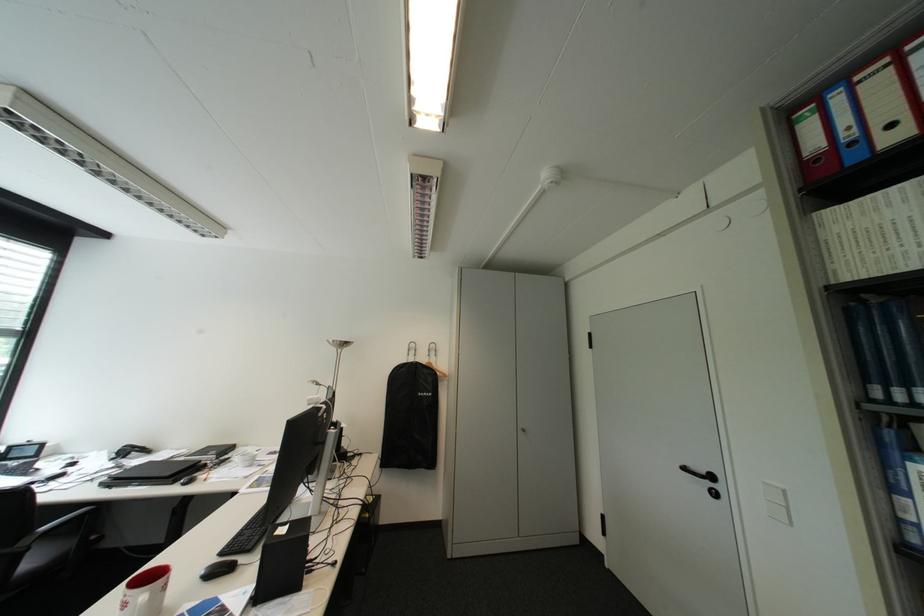
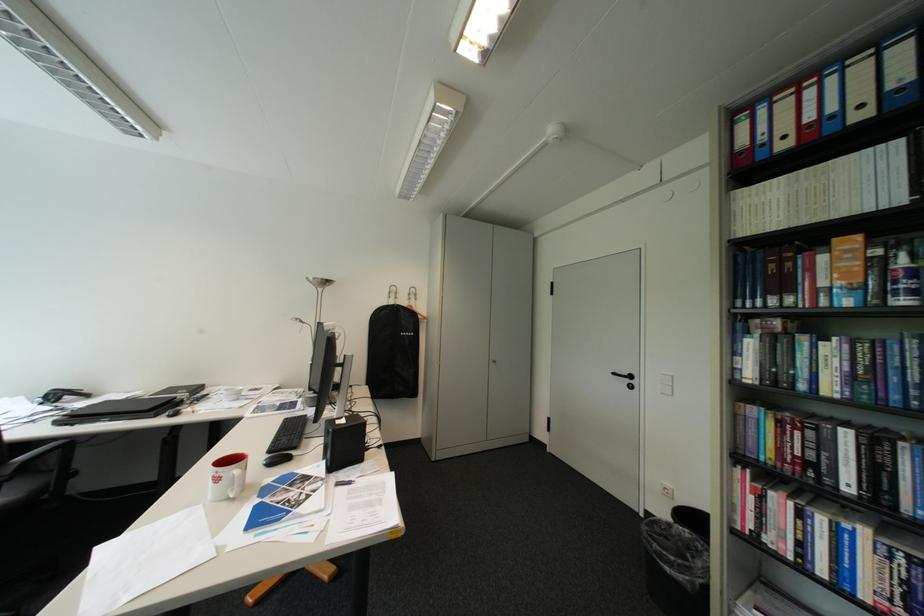
Where in the second image is the point corresponding to (x=837, y=146) from the first image?

(760, 145)